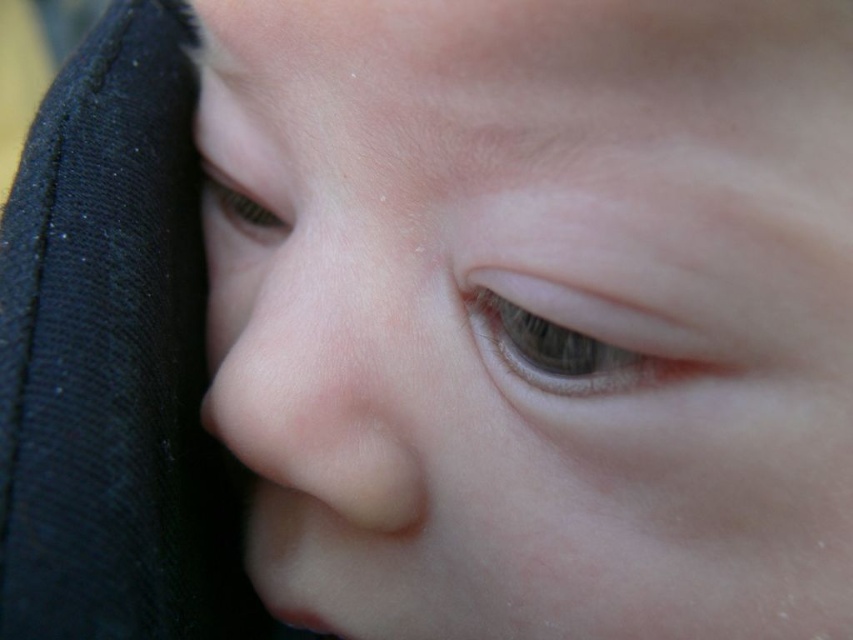
Which of these two, smooth skin nose at center or brown matte eye at center, stands taller?

smooth skin nose at center

Does smooth skin nose at center appear on the right side of brown matte eye at center?

Incorrect, smooth skin nose at center is not on the right side of brown matte eye at center.

Is point (285, 268) more distant than point (630, 333)?

Yes.

The width and height of the screenshot is (853, 640). What are the coordinates of `smooth skin nose at center` in the screenshot? It's located at (299, 388).

Is brown matte eye at center to the right of matte skin eye at upper left from the viewer's perspective?

Correct, you'll find brown matte eye at center to the right of matte skin eye at upper left.

Which is in front, point (669, 333) or point (222, 212)?

Point (669, 333) is in front.

You are a GUI agent. You are given a task and a screenshot of the screen. Output one action in this format:
    pyautogui.click(x=<x>, y=<y>)
    Task: Click on the brown matte eye at center
    The image size is (853, 640).
    Given the screenshot: What is the action you would take?
    pyautogui.click(x=581, y=337)

Does smooth skin nose at center appear under matte skin eye at upper left?

Correct, smooth skin nose at center is located below matte skin eye at upper left.

The image size is (853, 640). Describe the element at coordinates (299, 388) in the screenshot. I see `smooth skin nose at center` at that location.

Find the location of a particular element. This screenshot has height=640, width=853. smooth skin nose at center is located at coordinates (299, 388).